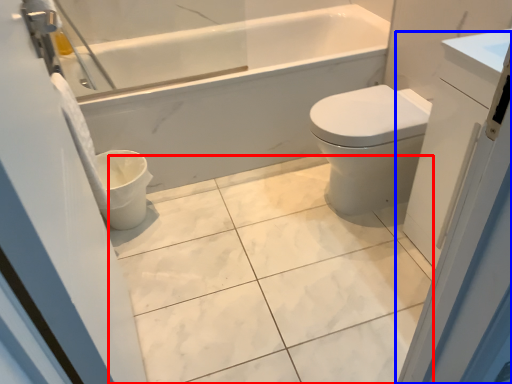
Question: Which of the following is the farthest to the observer, ceramic tile (highlighted by a red box) or screen door (highlighted by a blue box)?

Choices:
 (A) ceramic tile
 (B) screen door

Answer: (A)